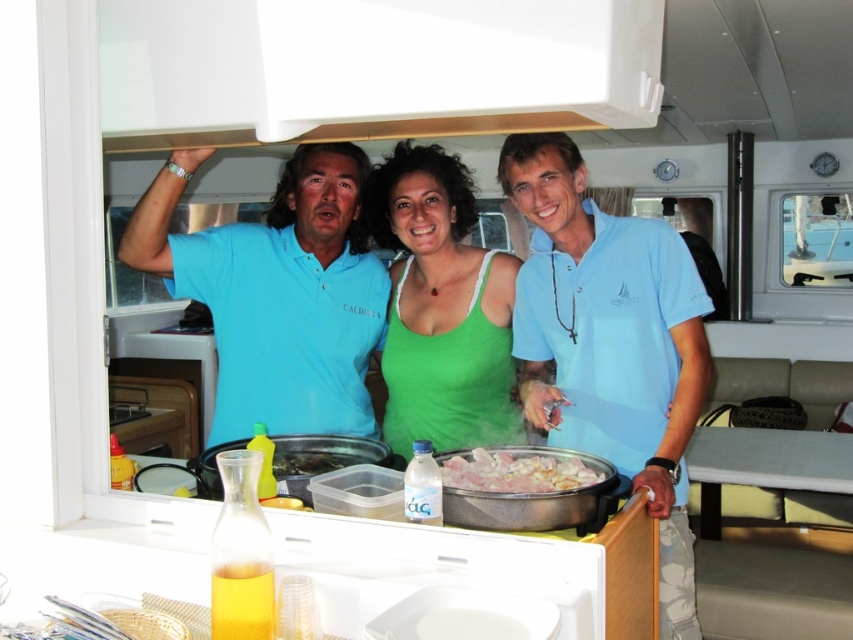
Is point (428, 244) positioned behind point (486, 474)?

Yes, point (428, 244) is behind point (486, 474).

Locate an element on the screen. This screenshot has height=640, width=853. green fabric tank top at center is located at coordinates (440, 307).

Image resolution: width=853 pixels, height=640 pixels. I want to click on green fabric tank top at center, so [x=440, y=307].

This screenshot has height=640, width=853. I want to click on light blue polo shirt at center, so click(610, 342).

Is light blue polo shirt at center closer to camera compared to green fabric tank top at center?

Yes, it is in front of green fabric tank top at center.

Does point (665, 234) come behind point (451, 250)?

No.

Image resolution: width=853 pixels, height=640 pixels. In order to click on light blue polo shirt at center in this screenshot , I will do `click(610, 342)`.

Does blue cotton shirt at upper left have a greater width compared to white glossy meat at center?

Yes, blue cotton shirt at upper left is wider than white glossy meat at center.

Which is more to the left, blue cotton shirt at upper left or white glossy meat at center?

blue cotton shirt at upper left is more to the left.

Which is behind, point (260, 273) or point (566, 458)?

The point (260, 273) is behind.

I want to click on blue cotton shirt at upper left, so click(x=277, y=292).